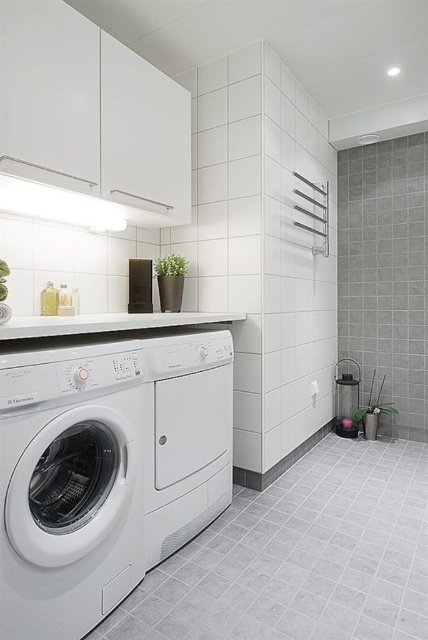
Is white matte washing machine at left shorter than white matte washing machine at center?

Incorrect, white matte washing machine at left's height does not fall short of white matte washing machine at center's.

Locate an element on the screen. Image resolution: width=428 pixels, height=640 pixels. white matte washing machine at left is located at coordinates (68, 486).